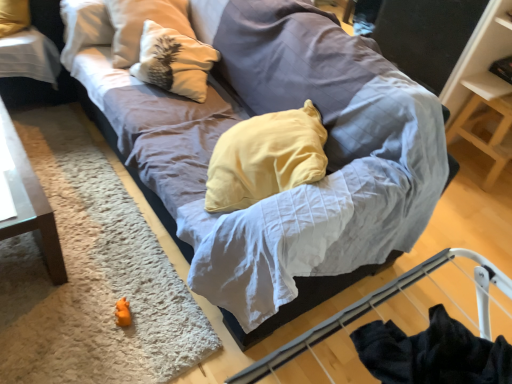
Locate an element on the screen. vacant space behind orange plush toy at lower left is located at coordinates (139, 278).